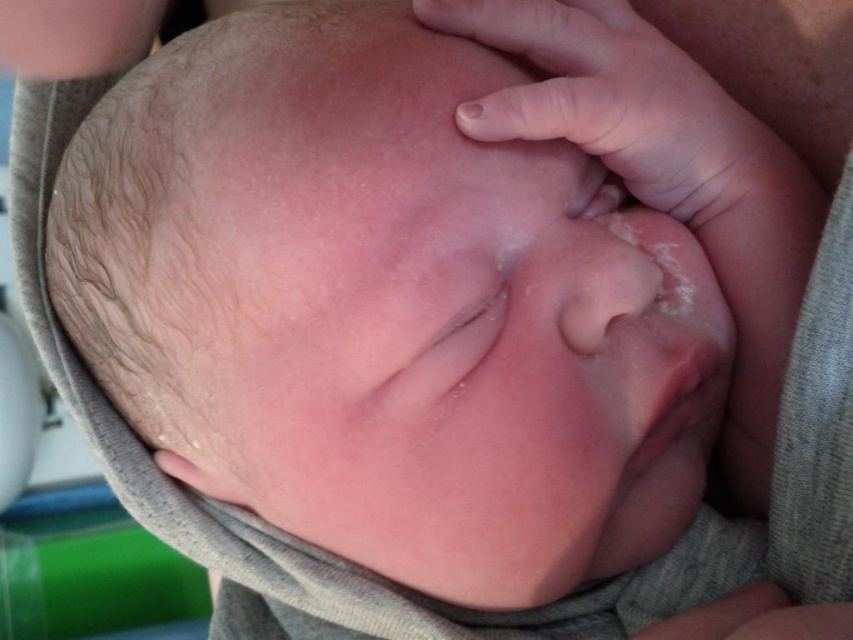
Question: Can you confirm if smooth skin hand at upper center is smaller than smooth skin hand at upper left?

Choices:
 (A) no
 (B) yes

Answer: (A)

Question: Does smooth skin hand at upper center have a greater width compared to smooth skin hand at upper left?

Choices:
 (A) yes
 (B) no

Answer: (A)

Question: Which of the following is the farthest from the observer?

Choices:
 (A) smooth skin hand at upper center
 (B) smooth skin hand at upper left

Answer: (B)

Question: Which object appears closest to the camera in this image?

Choices:
 (A) smooth skin hand at upper center
 (B) smooth skin hand at upper left

Answer: (A)

Question: Does smooth skin hand at upper center appear on the left side of smooth skin hand at upper left?

Choices:
 (A) yes
 (B) no

Answer: (B)